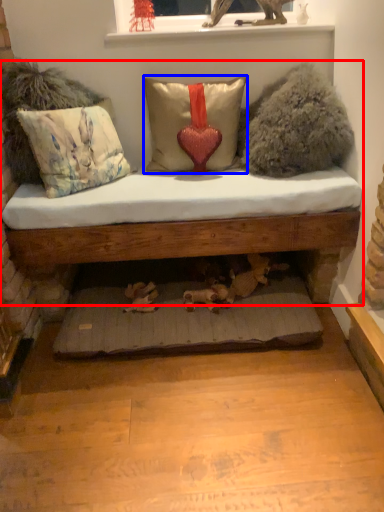
Question: Which point is closer to the camera, studio couch (highlighted by a red box) or pillow (highlighted by a blue box)?

Choices:
 (A) studio couch
 (B) pillow

Answer: (A)